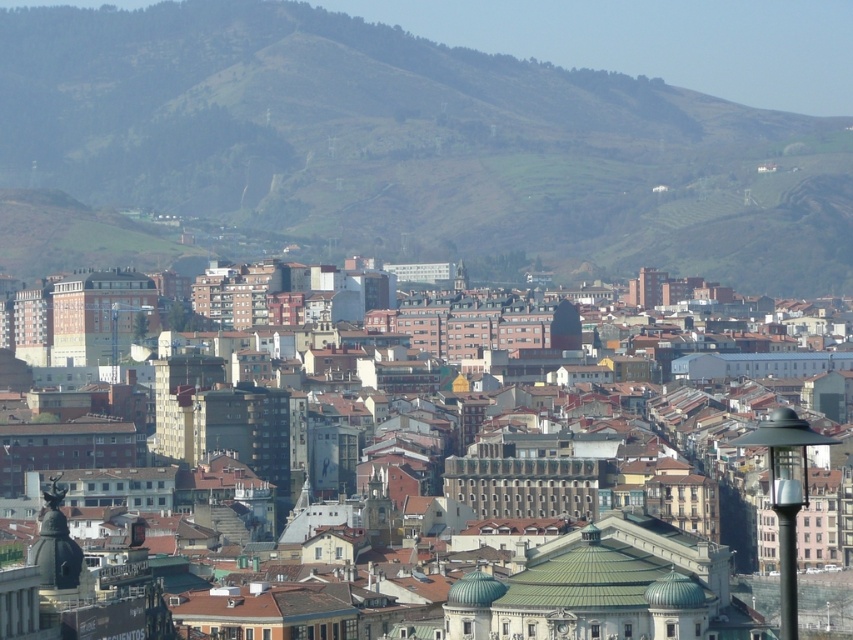
Question: Which object is farther from the camera taking this photo?

Choices:
 (A) green grassy hillside at upper center
 (B) matte black lamp post at right

Answer: (A)

Question: Does green grassy hillside at upper center lie in front of matte black lamp post at right?

Choices:
 (A) no
 (B) yes

Answer: (A)

Question: Which point is farther from the camera taking this photo?

Choices:
 (A) (553, 129)
 (B) (801, 483)

Answer: (A)

Question: Can you confirm if green grassy hillside at upper center is thinner than matte black lamp post at right?

Choices:
 (A) no
 (B) yes

Answer: (A)

Question: Which point is farther from the camera taking this photo?

Choices:
 (A) (787, 524)
 (B) (479, 170)

Answer: (B)

Question: Is green grassy hillside at upper center thinner than matte black lamp post at right?

Choices:
 (A) no
 (B) yes

Answer: (A)